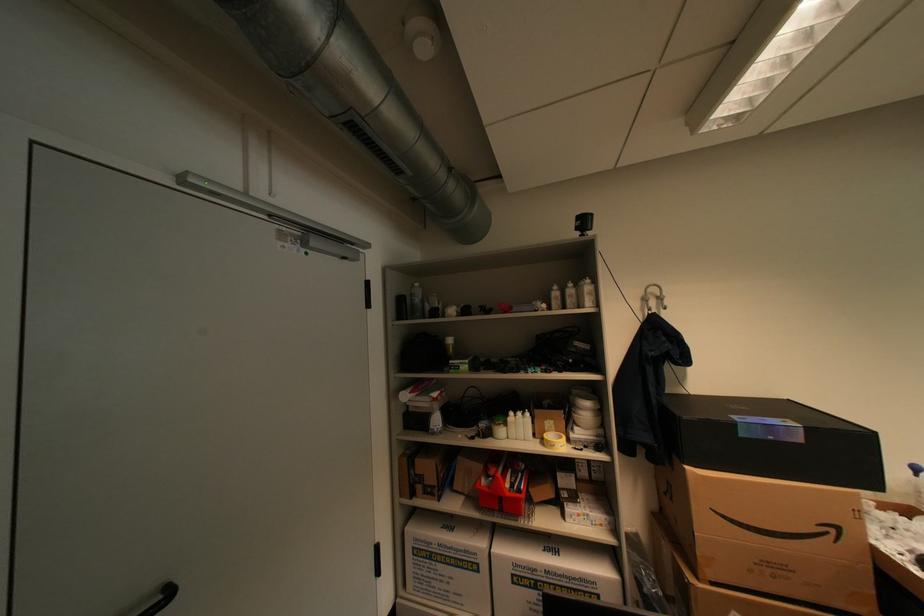
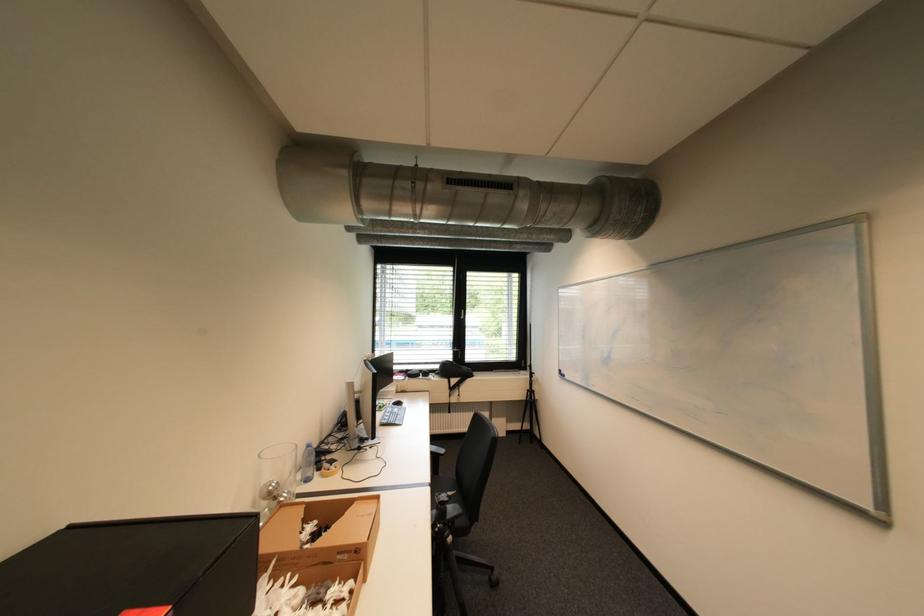
Where in the second image is the point corresponding to (883,434) from the first image?

(265, 516)